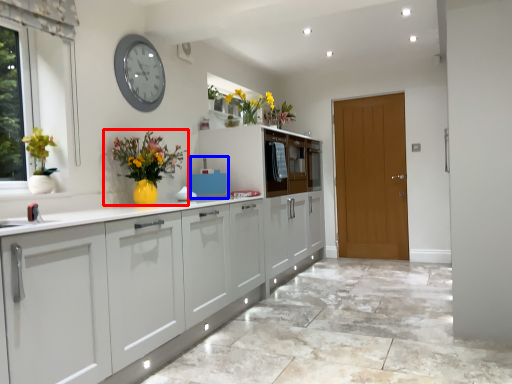
Question: Which of the following is the farthest to the observer, houseplant (highlighted by a red box) or appliance (highlighted by a blue box)?

Choices:
 (A) houseplant
 (B) appliance

Answer: (B)